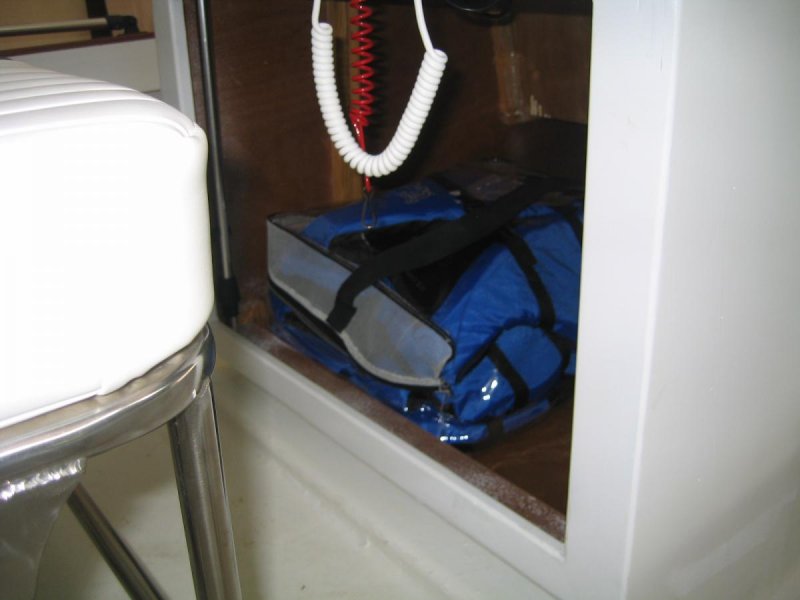
The image size is (800, 600). I want to click on table edge, so click(x=158, y=401).